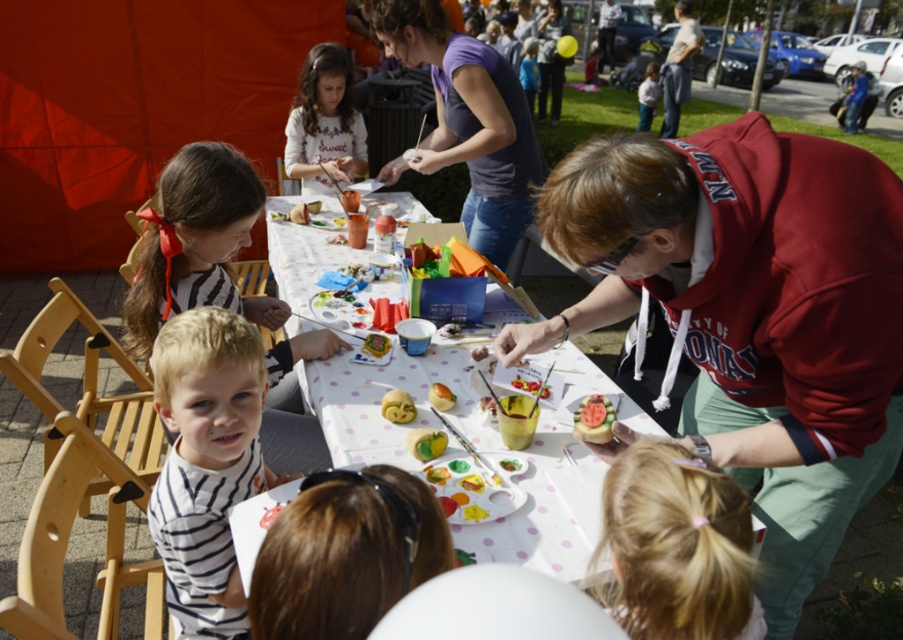
Does matte red hoodie at center come in front of yellow matte cookie at center?

Yes, matte red hoodie at center is in front of yellow matte cookie at center.

This screenshot has width=903, height=640. Find the location of `matte red hoodie at center`. matte red hoodie at center is located at coordinates (752, 314).

I want to click on matte red hoodie at center, so click(x=752, y=314).

Does green matte apple at center have a greater width compared to yellow matte cookie at center?

No, green matte apple at center is not wider than yellow matte cookie at center.

Between green matte apple at center and yellow matte cookie at center, which one is positioned lower?

green matte apple at center is lower down.

The width and height of the screenshot is (903, 640). What are the coordinates of `green matte apple at center` in the screenshot? It's located at (426, 442).

Between point (305, 96) and point (513, 380), which one is positioned in front?

Point (513, 380) is in front.

This screenshot has width=903, height=640. In order to click on white cotton shirt at upper center in this screenshot , I will do `click(324, 122)`.

In order to click on white cotton shirt at upper center in this screenshot , I will do `click(324, 122)`.

Locate an element on the screen. The image size is (903, 640). white cotton shirt at upper center is located at coordinates (324, 122).